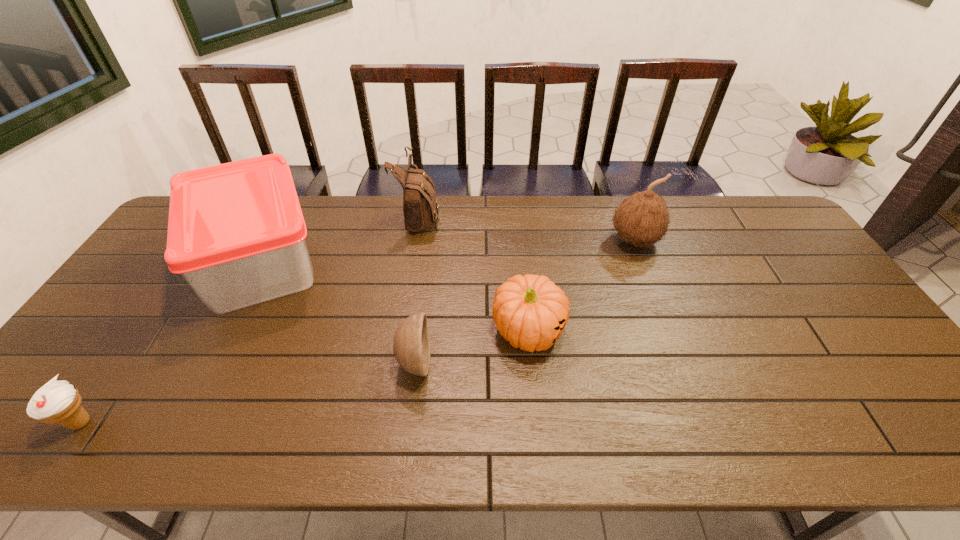
Locate an element on the screen. This screenshot has width=960, height=540. vacant space that is in between the second object from right to left and the nearest object is located at coordinates (304, 377).

Identify the location of free area in between the pumpkin and the shoulder bag. Image resolution: width=960 pixels, height=540 pixels. (474, 274).

Identify the location of vacant area between the shoulder bag and the nearest object. The image size is (960, 540). click(x=250, y=319).

Locate an element on the screen. This screenshot has height=540, width=960. vacant point located between the bowl and the tray is located at coordinates (338, 312).

Locate which object ranks second in proximity to the tray. Please provide its 2D coordinates. Your answer should be formatted as a tuple, i.e. [(x, y)], where the tuple contains the x and y coordinates of a point satisfying the conditions above.

[(59, 402)]

At what (x,y) coordinates should I click in order to perform the action: click on object that is the second closest to the nearest object. Please return your answer as a coordinate pair (x, y). This screenshot has height=540, width=960. Looking at the image, I should click on (411, 345).